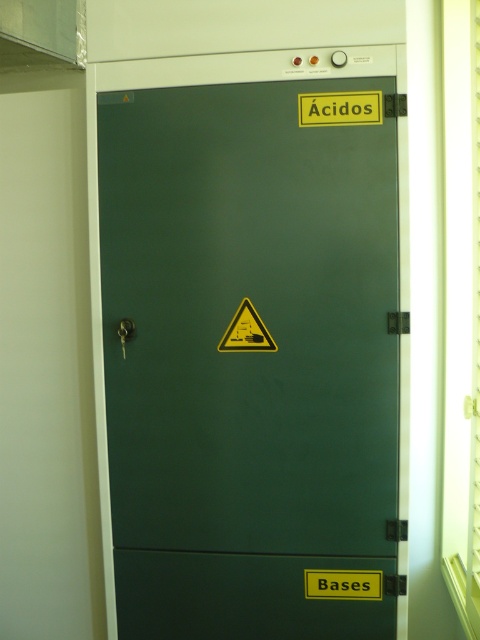
Question: Which object is farther from the camera taking this photo?

Choices:
 (A) yellowmaterial/texturetriangle at upper center
 (B) green matte cabinet at center
 (C) yellow triangular warning sign at center

Answer: (C)

Question: Is yellowmaterial/texturetriangle at upper center below yellow triangular warning sign at center?

Choices:
 (A) yes
 (B) no

Answer: (B)

Question: Is yellowmaterial/texturetriangle at upper center above yellow triangular warning sign at center?

Choices:
 (A) no
 (B) yes

Answer: (B)

Question: Which object is the closest to the yellowmaterial/texturetriangle at upper center?

Choices:
 (A) green matte cabinet at center
 (B) yellow triangular warning sign at center

Answer: (A)

Question: Which object appears farthest from the camera in this image?

Choices:
 (A) yellowmaterial/texturetriangle at upper center
 (B) yellow triangular warning sign at center

Answer: (B)

Question: Does yellowmaterial/texturetriangle at upper center appear on the left side of yellow triangular warning sign at center?

Choices:
 (A) yes
 (B) no

Answer: (B)